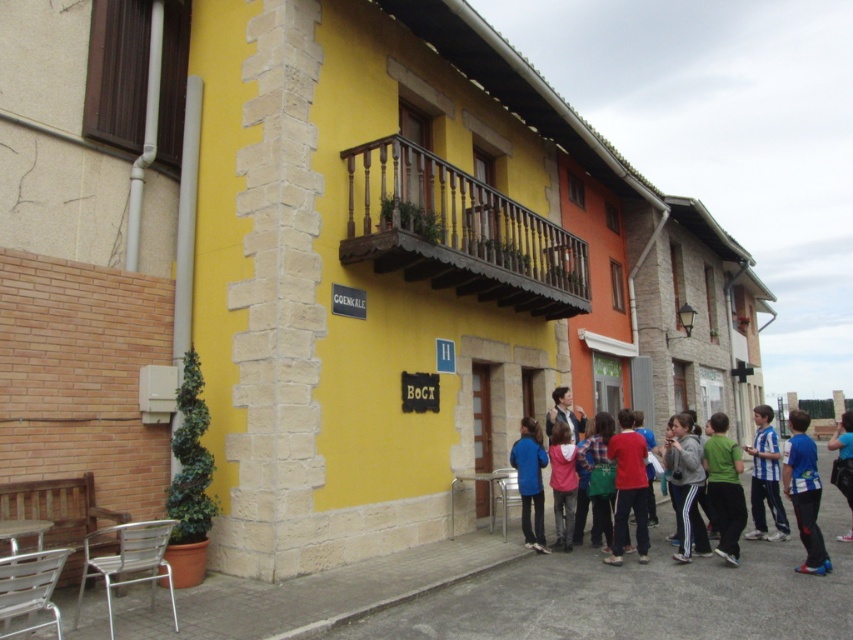
Question: Considering the relative positions of blue jersey at center and gray fleece jacket at lower center in the image provided, where is blue jersey at center located with respect to gray fleece jacket at lower center?

Choices:
 (A) left
 (B) right

Answer: (B)

Question: Which point is farther to the camera?

Choices:
 (A) plaid shirt at center
 (B) blue fabric shirt at lower right

Answer: (B)

Question: Which point is farther to the camera?

Choices:
 (A) plaid shirt at center
 (B) blue jersey at center
 (C) blue and white striped shirt at right

Answer: (C)

Question: Considering the relative positions of blue fabric shirt at lower right and matte black jacket at center in the image provided, where is blue fabric shirt at lower right located with respect to matte black jacket at center?

Choices:
 (A) above
 (B) below

Answer: (B)

Question: Does wooden at upper center come behind blue fabric jacket at center?

Choices:
 (A) yes
 (B) no

Answer: (B)

Question: Based on their relative distances, which object is farther from the matte black jacket at center?

Choices:
 (A) plaid shirt at center
 (B) blue jersey at center
 (C) wooden at upper center
 (D) pink fabric shirt at center

Answer: (B)